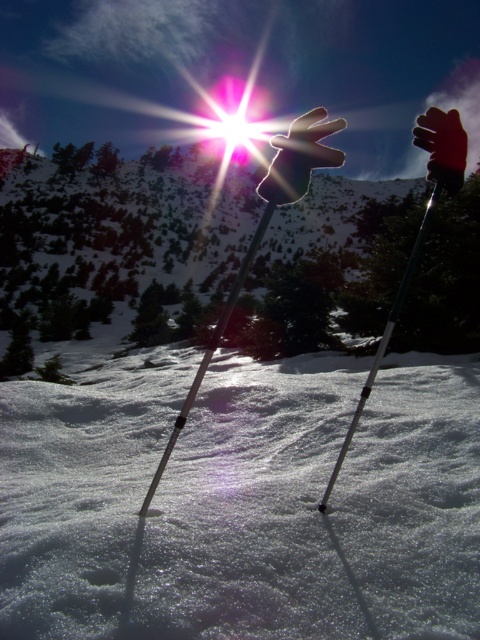
You are standing at the bottom of the slope and looking up. There are two points marked on the snowy landscape. Which point is closer to you, point (433, 125) or point (374, 371)?

Point (433, 125) is in front of point (374, 371), so it is closer to you.

You are standing at the point with coordinates point (x=460, y=182) and want to walk to the point with coordinates point (x=312, y=550). Which direction should you move relative to the other point?

Point (x=312, y=550) is in front of point (x=460, y=182), so you should move forward towards point (x=312, y=550).